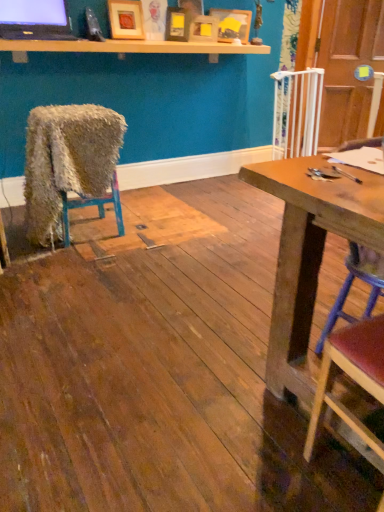
Describe the element at coordinates (204, 29) in the screenshot. I see `wooden picture frame at upper center, arranged as the third picture frame when viewed from the left` at that location.

Locate an element on the screen. This screenshot has width=384, height=512. wooden picture frame at upper center, which is the 4th picture frame from right to left is located at coordinates pos(126,19).

This screenshot has width=384, height=512. Find the location of `wooden picture frame at upper center, the second picture frame from the right`. wooden picture frame at upper center, the second picture frame from the right is located at coordinates (204, 29).

Which object is positioned more to the left, light wood shelf at upper center or wooden seat at right, the 1th chair when ordered from right to left?

Positioned to the left is light wood shelf at upper center.

Is light wood shelf at upper center completely or partially outside of wooden seat at right, which is the third chair in left-to-right order?

That's correct, light wood shelf at upper center is outside of wooden seat at right, which is the third chair in left-to-right order.

Between light wood shelf at upper center and wooden seat at right, which is the third chair in left-to-right order, which one has smaller size?

light wood shelf at upper center is smaller.

How many degrees apart are the facing directions of light wood shelf at upper center and wooden seat at right, the second chair from the back?

light wood shelf at upper center and wooden seat at right, the second chair from the back, are facing 0.396 degrees away from each other.

Considering the sizes of objects light wood shelf at upper center and fuzzy fabric chair at left, which is the first chair in left-to-right order, in the image provided, who is wider, light wood shelf at upper center or fuzzy fabric chair at left, which is the first chair in left-to-right order,?

fuzzy fabric chair at left, which is the first chair in left-to-right order, is wider.

From a real-world perspective, is light wood shelf at upper center physically below fuzzy fabric chair at left, which is the first chair in left-to-right order?

Actually, light wood shelf at upper center is physically above fuzzy fabric chair at left, which is the first chair in left-to-right order, in the real world.

Where is `the 1st chair in front of the light wood shelf at upper center`? Image resolution: width=384 pixels, height=512 pixels. the 1st chair in front of the light wood shelf at upper center is located at coordinates (67, 161).

Does point (161, 48) come behind point (122, 132)?

Yes, point (161, 48) is behind point (122, 132).

Between matte black monitor at upper left and wooden picture frame at upper center, arranged as the 1th picture frame when viewed from the right, which one is positioned in front?

matte black monitor at upper left.

Is matte black monitor at upper left taller or shorter than wooden picture frame at upper center, arranged as the 1th picture frame when viewed from the right?

matte black monitor at upper left is shorter than wooden picture frame at upper center, arranged as the 1th picture frame when viewed from the right.

Based on the photo, from the image's perspective, relative to wooden picture frame at upper center, arranged as the 1th picture frame when viewed from the right, is matte black monitor at upper left above or below?

Based on their image positions, matte black monitor at upper left is located beneath wooden picture frame at upper center, arranged as the 1th picture frame when viewed from the right.

Looking at their sizes, would you say matte black monitor at upper left is wider or thinner than wooden picture frame at upper center, arranged as the 1th picture frame when viewed from the right?

matte black monitor at upper left is wider than wooden picture frame at upper center, arranged as the 1th picture frame when viewed from the right.

Can matte wooden picture frame at upper center, positioned as the 2th picture frame in left-to-right order, be found inside wooden picture frame at upper center, arranged as the 1th picture frame when viewed from the right?

Definitely not — matte wooden picture frame at upper center, positioned as the 2th picture frame in left-to-right order, is not inside wooden picture frame at upper center, arranged as the 1th picture frame when viewed from the right.

Is point (249, 23) positioned after point (183, 27)?

Yes.

Measure the distance between wooden picture frame at upper center, which is counted as the 4th picture frame, starting from the left, and matte wooden picture frame at upper center, positioned as the 2th picture frame in left-to-right order.

wooden picture frame at upper center, which is counted as the 4th picture frame, starting from the left, is 13.69 inches away from matte wooden picture frame at upper center, positioned as the 2th picture frame in left-to-right order.

Considering the sizes of wooden picture frame at upper center, arranged as the 1th picture frame when viewed from the right, and matte wooden picture frame at upper center, positioned as the 2th picture frame in left-to-right order, in the image, is wooden picture frame at upper center, arranged as the 1th picture frame when viewed from the right, taller or shorter than matte wooden picture frame at upper center, positioned as the 2th picture frame in left-to-right order,?

Clearly, wooden picture frame at upper center, arranged as the 1th picture frame when viewed from the right, is taller compared to matte wooden picture frame at upper center, positioned as the 2th picture frame in left-to-right order.

Which object is wider, wooden picture frame at upper center, arranged as the third picture frame when viewed from the left, or wooden chair at lower right, the 2th chair when ordered from left to right?

Wider between the two is wooden chair at lower right, the 2th chair when ordered from left to right.

Is wooden picture frame at upper center, arranged as the third picture frame when viewed from the left, aimed at wooden chair at lower right, marked as the 1th chair in a front-to-back arrangement?

Yes, wooden picture frame at upper center, arranged as the third picture frame when viewed from the left, is oriented towards wooden chair at lower right, marked as the 1th chair in a front-to-back arrangement.

Is wooden picture frame at upper center, arranged as the third picture frame when viewed from the left, bigger or smaller than wooden chair at lower right, the 2th chair when ordered from left to right?

Considering their sizes, wooden picture frame at upper center, arranged as the third picture frame when viewed from the left, takes up less space than wooden chair at lower right, the 2th chair when ordered from left to right.

Considering the points (23, 24) and (118, 114), which point is behind, point (23, 24) or point (118, 114)?

The point (118, 114) is farther.

Looking at their sizes, would you say matte black monitor at upper left is wider or thinner than fuzzy fabric chair at left, the third chair viewed from the right?

In the image, matte black monitor at upper left appears to be more narrow than fuzzy fabric chair at left, the third chair viewed from the right.

Is the depth of matte black monitor at upper left less than that of fuzzy fabric chair at left, which appears as the first chair when viewed from the back?

No, it is behind fuzzy fabric chair at left, which appears as the first chair when viewed from the back.

Does wooden picture frame at upper center, which is the 4th picture frame from right to left, have a lesser height compared to light wood shelf at upper center?

No, wooden picture frame at upper center, which is the 4th picture frame from right to left, is not shorter than light wood shelf at upper center.

From a real-world perspective, is wooden picture frame at upper center, which is the 4th picture frame from right to left, positioned over light wood shelf at upper center based on gravity?

Yes, from a real-world perspective, wooden picture frame at upper center, which is the 4th picture frame from right to left, is above light wood shelf at upper center.

Considering the positions of point (127, 38) and point (112, 51), is point (127, 38) closer or farther from the camera than point (112, 51)?

Clearly, point (127, 38) is more distant from the camera than point (112, 51).

Is light wood shelf at upper center inside wooden picture frame at upper center, the 1th picture frame when ordered from left to right?

No, wooden picture frame at upper center, the 1th picture frame when ordered from left to right, does not contain light wood shelf at upper center.

Identify the location of chair that is the 2nd object located below the light wood shelf at upper center (from the image's perspective). The image size is (384, 512). (351, 285).

Where is `shelf above the fuzzy fabric chair at left, which is counted as the 3th chair, starting from the front (from the image's perspective)`? shelf above the fuzzy fabric chair at left, which is counted as the 3th chair, starting from the front (from the image's perspective) is located at coordinates 133,47.

Based on their spatial positions, is wooden seat at right, positioned as the 2th chair in front-to-back order, or wooden picture frame at upper center, which is the 4th picture frame from right to left, further from light wood shelf at upper center?

The object further to light wood shelf at upper center is wooden seat at right, positioned as the 2th chair in front-to-back order.

When comparing their distances from wooden picture frame at upper center, which is counted as the 4th picture frame, starting from the left, does fuzzy fabric chair at left, which appears as the first chair when viewed from the back, or matte wooden picture frame at upper center, positioned as the 2th picture frame in left-to-right order, seem further?

fuzzy fabric chair at left, which appears as the first chair when viewed from the back, lies further to wooden picture frame at upper center, which is counted as the 4th picture frame, starting from the left, than the other object.

Estimate the real-world distances between objects in this image. Which object is further from wooden picture frame at upper center, which is counted as the 4th picture frame, starting from the left, matte wooden picture frame at upper center, the third picture frame when ordered from right to left, or matte black monitor at upper left?

matte black monitor at upper left is positioned further to the anchor wooden picture frame at upper center, which is counted as the 4th picture frame, starting from the left.

Estimate the real-world distances between objects in this image. Which object is further from matte wooden picture frame at upper center, the third picture frame when ordered from right to left, wooden seat at right, the second chair from the back, or matte black monitor at upper left?

Among the two, wooden seat at right, the second chair from the back, is located further to matte wooden picture frame at upper center, the third picture frame when ordered from right to left.

Considering their positions, is light wood shelf at upper center positioned closer to wooden chair at lower right, the 2th chair when ordered from left to right, than matte black monitor at upper left?

Among the two, light wood shelf at upper center is located nearer to wooden chair at lower right, the 2th chair when ordered from left to right.

Considering their positions, is wooden picture frame at upper center, the 1th picture frame when ordered from left to right, positioned further to wooden picture frame at upper center, arranged as the 1th picture frame when viewed from the right, than wooden seat at right, which is the third chair in left-to-right order?

The object further to wooden picture frame at upper center, arranged as the 1th picture frame when viewed from the right, is wooden seat at right, which is the third chair in left-to-right order.

In the scene shown: From the image, which object appears to be nearer to wooden chair at lower right, marked as the 1th chair in a front-to-back arrangement, matte wooden picture frame at upper center, positioned as the 2th picture frame in left-to-right order, or fuzzy fabric chair at left, which is counted as the 3th chair, starting from the front?

Among the two, fuzzy fabric chair at left, which is counted as the 3th chair, starting from the front, is located nearer to wooden chair at lower right, marked as the 1th chair in a front-to-back arrangement.

Based on their spatial positions, is wooden picture frame at upper center, arranged as the 1th picture frame when viewed from the right, or wooden picture frame at upper center, which is the 4th picture frame from right to left, closer to wooden picture frame at upper center, the second picture frame from the right?

Based on the image, wooden picture frame at upper center, arranged as the 1th picture frame when viewed from the right, appears to be nearer to wooden picture frame at upper center, the second picture frame from the right.

Locate an element on the screen. The height and width of the screenshot is (512, 384). shelf between wooden picture frame at upper center, arranged as the third picture frame when viewed from the left, and fuzzy fabric chair at left, which is the first chair in left-to-right order, from top to bottom is located at coordinates (133, 47).

The height and width of the screenshot is (512, 384). I want to click on picture frame between wooden picture frame at upper center, the 1th picture frame when ordered from left to right, and wooden picture frame at upper center, the second picture frame from the right, in the horizontal direction, so click(x=177, y=24).

At what (x,y) coordinates should I click in order to perform the action: click on shelf between wooden picture frame at upper center, the 1th picture frame when ordered from left to right, and fuzzy fabric chair at left, which appears as the first chair when viewed from the back, in the up-down direction. Please return your answer as a coordinate pair (x, y). This screenshot has width=384, height=512. Looking at the image, I should click on (133, 47).

Where is `picture frame positioned between light wood shelf at upper center and matte wooden picture frame at upper center, the third picture frame when ordered from right to left, from near to far`? Image resolution: width=384 pixels, height=512 pixels. picture frame positioned between light wood shelf at upper center and matte wooden picture frame at upper center, the third picture frame when ordered from right to left, from near to far is located at coordinates (126, 19).